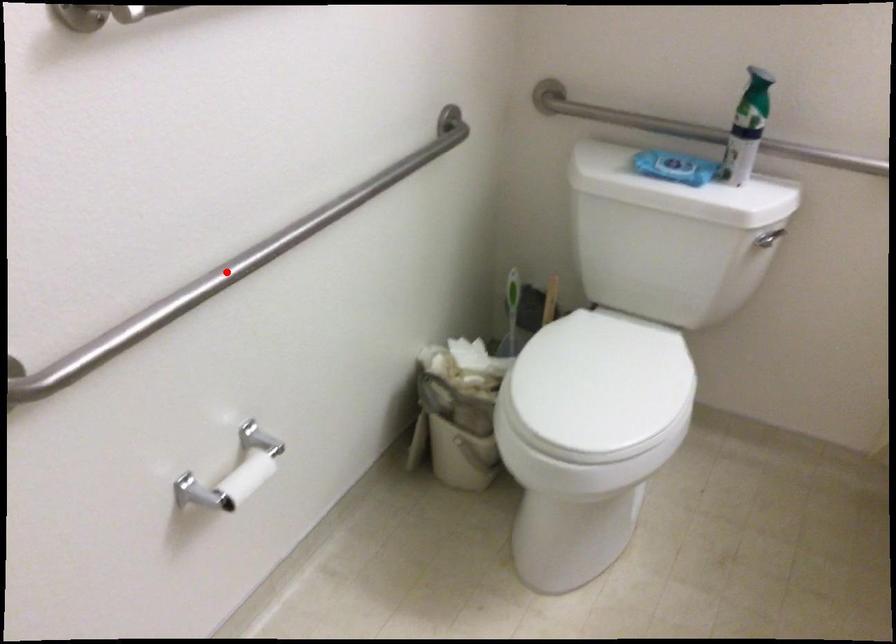
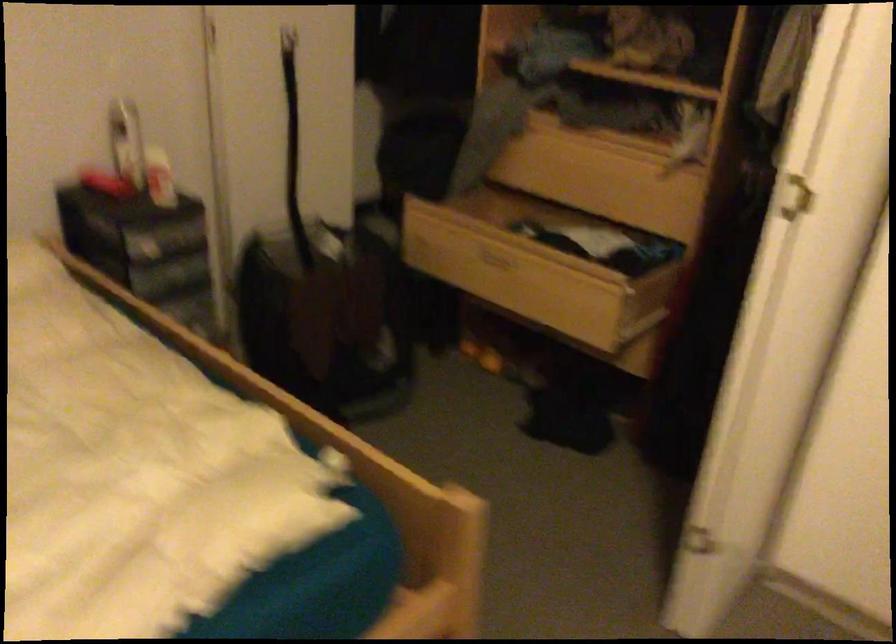
Question: I am providing you with two images of the same scene from different viewpoints. A red point is marked on the first image. Is the red point's position out of view in image 2?

Choices:
 (A) Yes
 (B) No

Answer: (A)